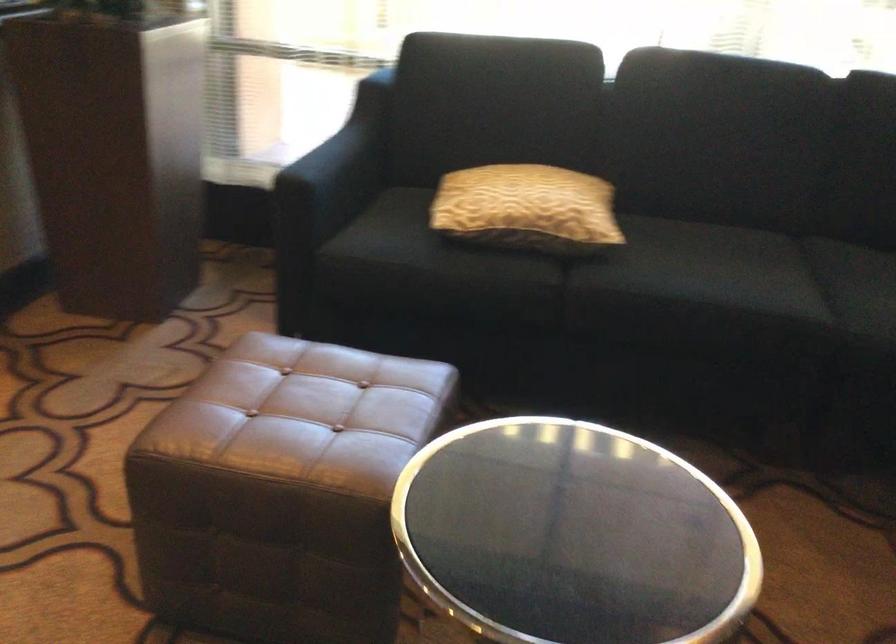
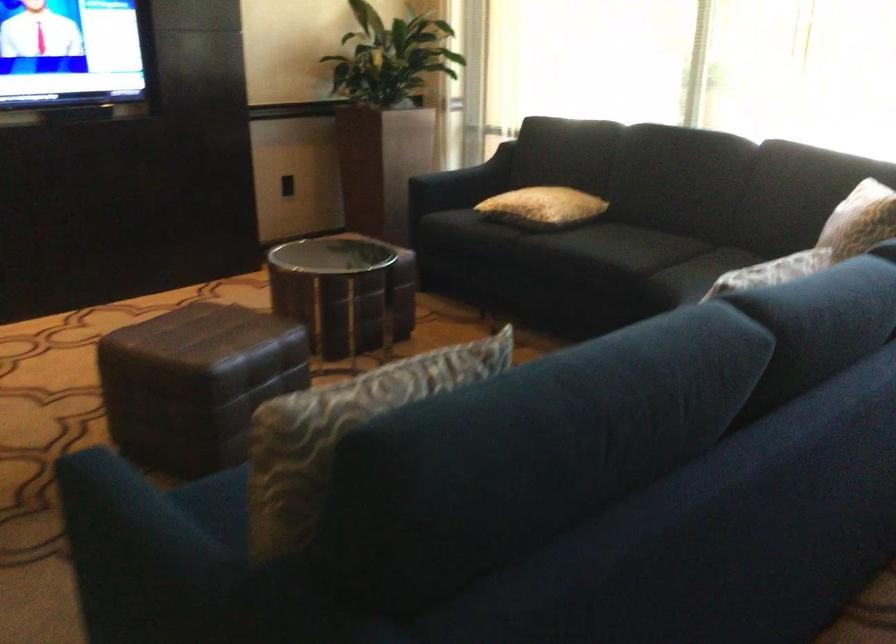
Where in the second image is the point corresponding to point (791, 297) from the first image?

(626, 254)